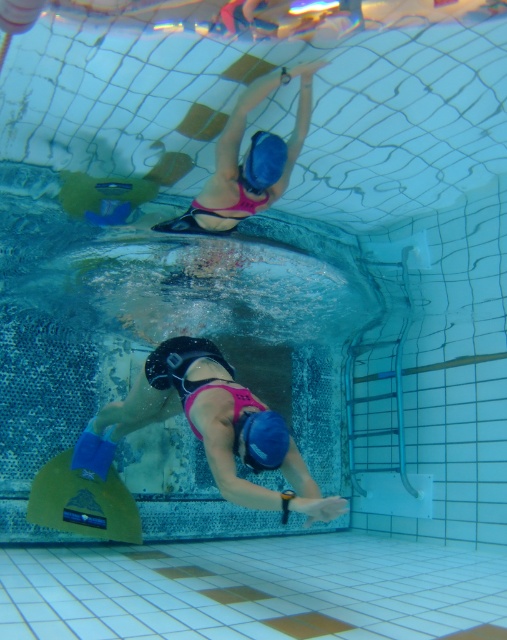
You are a lifeguard observing an underwater scene in a swimming pool. You notice a point marked at coordinates (209, 428). Which object in the scene corresponds to this point?

The point at coordinates (209, 428) corresponds to the pink matte swimsuit at center.

You are a lifeguard observing the underwater scene. You notice the pink matte swimsuit at center and the matte blue snorkel at upper center. Which object is positioned higher in the image?

The pink matte swimsuit at center has a greater height compared to the matte blue snorkel at upper center, so the pink matte swimsuit at center is positioned higher in the image.

Looking at this image, you are an underwater photographer capturing the scene from below. You need to position your camera to frame both the pink matte swimsuit at center and the matte blue snorkel at upper center. Which object should you adjust your camera to focus on first to ensure both are in the frame?

The pink matte swimsuit at center is positioned on the left side of the matte blue snorkel at upper center, so you should focus on the pink matte swimsuit at center first to ensure both objects are included in the frame.